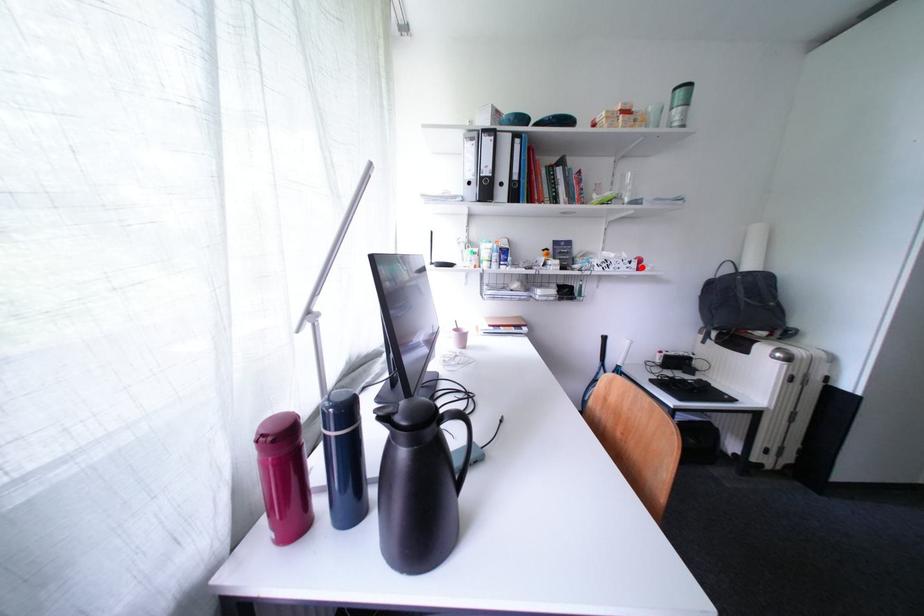
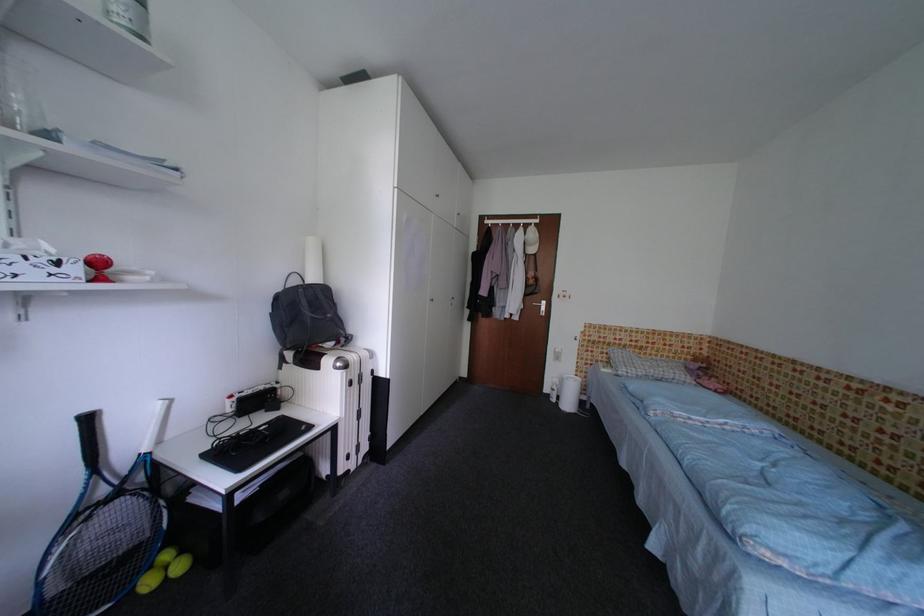
Where in the second image is the point corresponding to the highlighted location from the first image?

(83, 272)